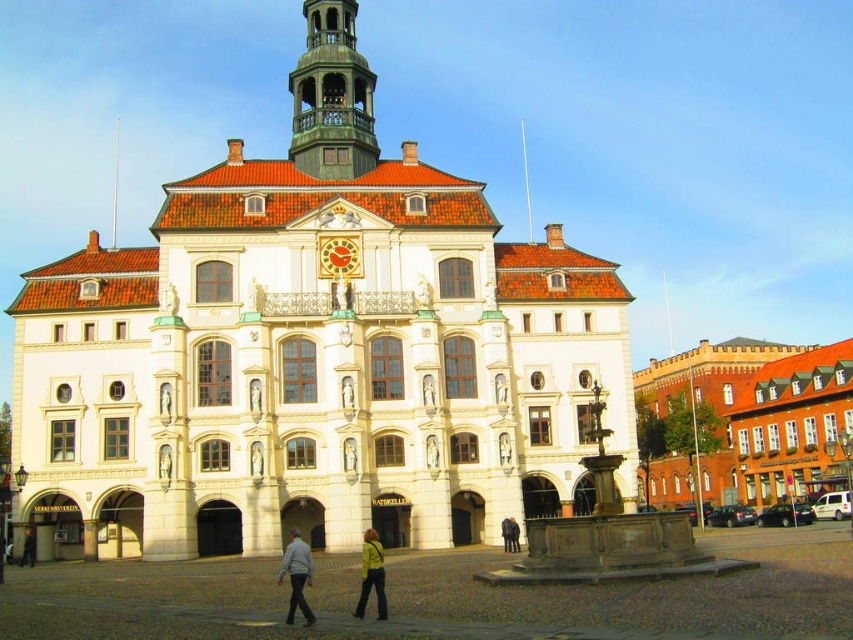
Question: Does light gray fabric jacket at lower center have a greater width compared to yellow leather jacket at lower center?

Choices:
 (A) no
 (B) yes

Answer: (B)

Question: Which point is farther from the camera taking this photo?

Choices:
 (A) (351, 80)
 (B) (515, 545)
 (C) (291, 560)

Answer: (A)

Question: Which object is closer to the camera taking this photo?

Choices:
 (A) light gray fabric jacket at lower center
 (B) green fabric jacket at center

Answer: (A)

Question: Can you confirm if white stone building at center is thinner than light gray fabric jacket at lower center?

Choices:
 (A) yes
 (B) no

Answer: (B)

Question: Based on their relative distances, which object is farther from the yellow leather jacket at lower center?

Choices:
 (A) white stone building at center
 (B) green fabric jacket at center
 (C) green wooden bell tower at upper center
 (D) light gray fabric jacket at lower center

Answer: (C)

Question: Can you confirm if white stone building at center is positioned to the right of light gray fabric jacket at lower center?

Choices:
 (A) yes
 (B) no

Answer: (B)